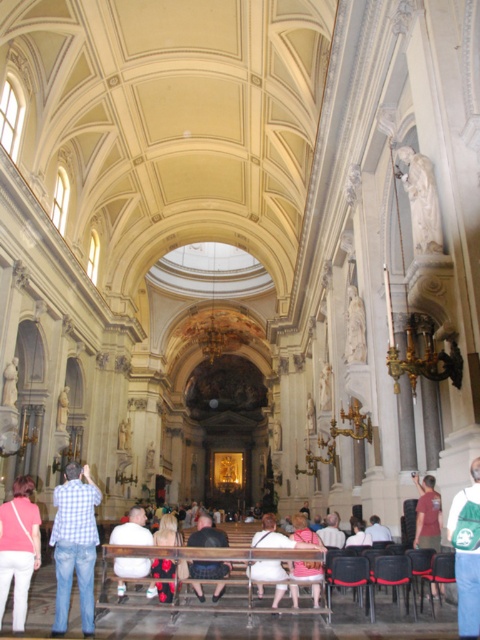
Question: Is white cotton shirt at lower center thinner than red fabric pants at center?

Choices:
 (A) no
 (B) yes

Answer: (A)

Question: Based on their relative distances, which object is nearer to the white fabric bag at lower right?

Choices:
 (A) dark blue jeans at center
 (B) red fabric pants at center
 (C) checkered shirt at lower left

Answer: (A)

Question: Which object is closer to the camera taking this photo?

Choices:
 (A) matte pink shirt at lower left
 (B) checkered shirt at lower left
 (C) white fabric bag at lower right
 (D) maroon fabric shirt at lower right

Answer: (C)

Question: Which object is closer to the camera taking this photo?

Choices:
 (A) dark blue jeans at center
 (B) white cotton dress at center
 (C) matte pink shirt at lower left

Answer: (C)

Question: Is checkered shirt at lower left thinner than maroon fabric shirt at lower right?

Choices:
 (A) no
 (B) yes

Answer: (A)

Question: Does white cotton shirt at lower center appear on the left side of white fabric shirt at lower center?

Choices:
 (A) yes
 (B) no

Answer: (A)